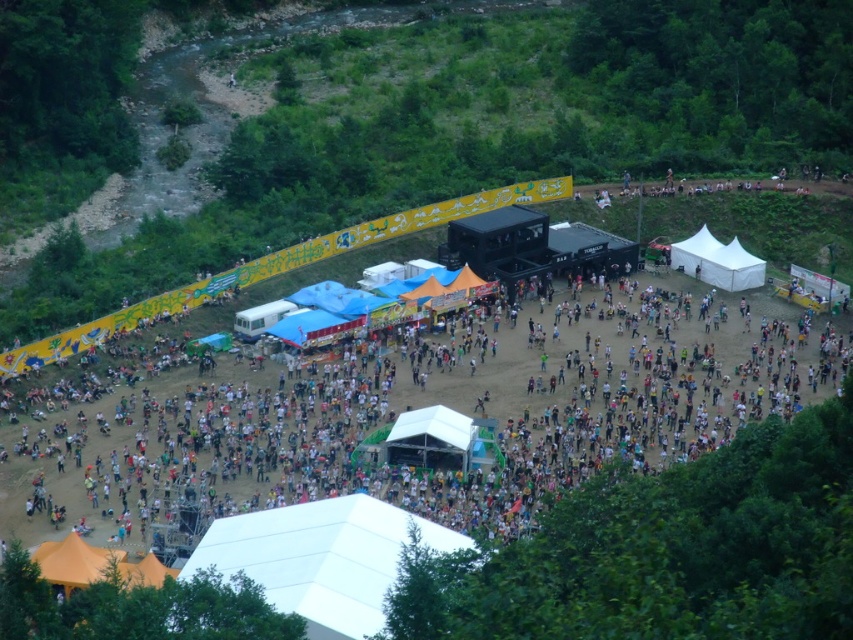
Does point (216, 563) lie behind point (746, 259)?

No, (216, 563) is in front of (746, 259).

Can you confirm if white matte canopy at lower center is positioned to the right of white fabric canopy at center-right?

In fact, white matte canopy at lower center is to the left of white fabric canopy at center-right.

Measure the distance between white matte canopy at lower center and camera.

They are 58.17 meters apart.

Identify the location of white matte canopy at lower center. The height and width of the screenshot is (640, 853). (321, 557).

This screenshot has width=853, height=640. I want to click on white matte tent at center, so click(x=410, y=408).

This screenshot has height=640, width=853. Describe the element at coordinates (410, 408) in the screenshot. I see `white matte tent at center` at that location.

Locate an element on the screen. The height and width of the screenshot is (640, 853). white matte tent at center is located at coordinates (410, 408).

Can you confirm if white matte tent at center is positioned to the left of white fabric canopy at center-right?

Correct, you'll find white matte tent at center to the left of white fabric canopy at center-right.

Does white matte tent at center have a larger size compared to white fabric canopy at center-right?

Yes.

Between point (490, 474) and point (762, 276), which one is positioned behind?

Point (762, 276)

Locate an element on the screen. white matte tent at center is located at coordinates click(x=410, y=408).